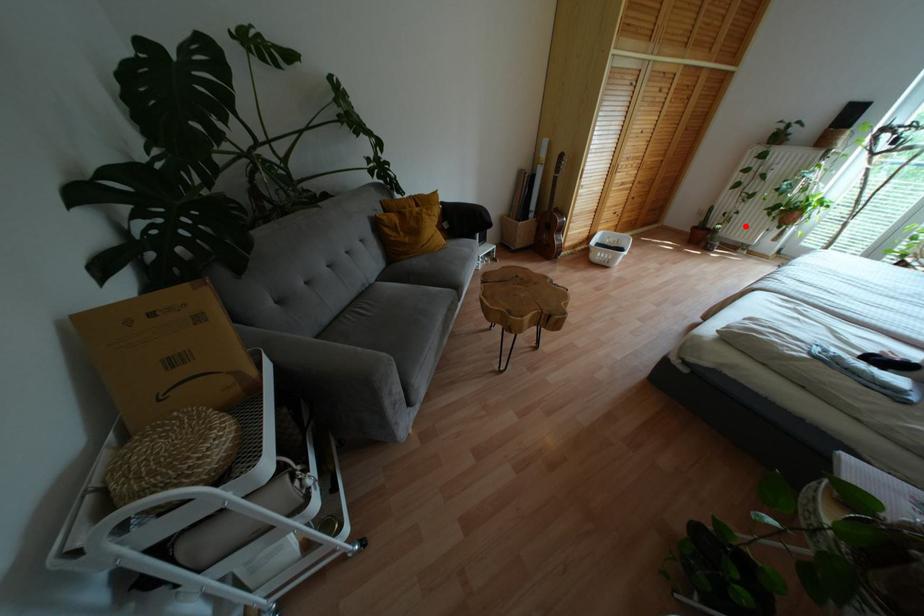
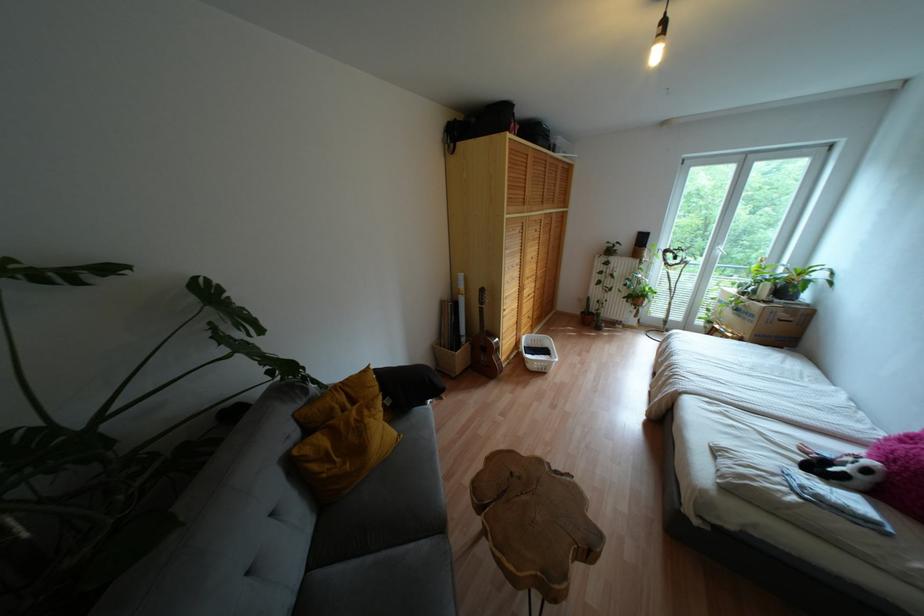
Question: I am providing you with two images of the same scene from different viewpoints. A red point is marked on the first image. At the location where the point appears in image 1, is it still visible in image 2?

Choices:
 (A) Yes
 (B) No

Answer: (A)